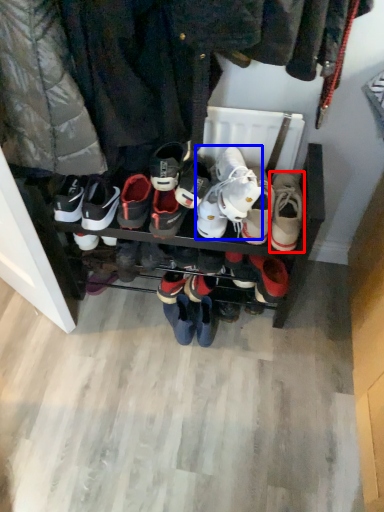
Question: Which point is closer to the camera, footwear (highlighted by a red box) or footwear (highlighted by a blue box)?

Choices:
 (A) footwear
 (B) footwear

Answer: (A)